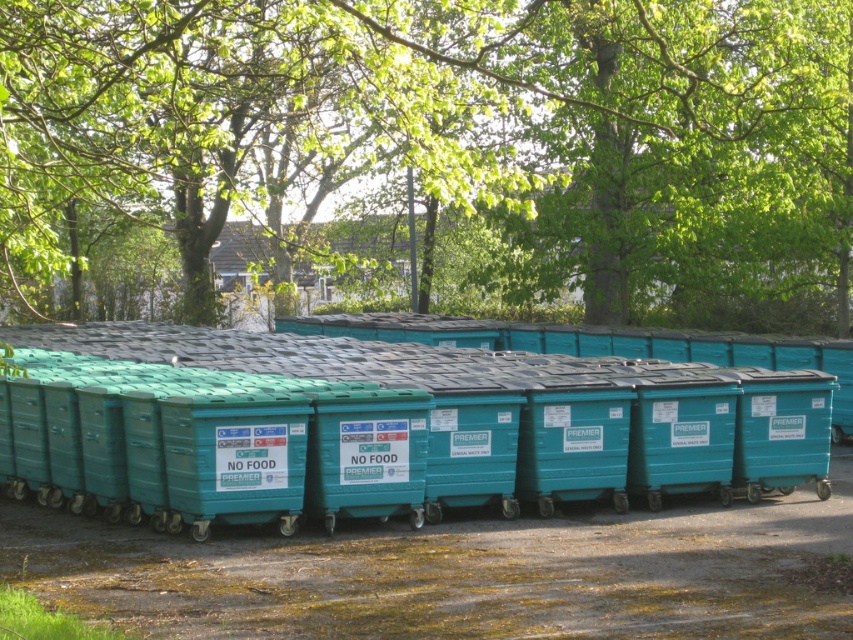
Question: Is green leafy tree at upper center to the right of teal plastic bin at center from the viewer's perspective?

Choices:
 (A) no
 (B) yes

Answer: (B)

Question: Is green leafy tree at upper center to the left of teal plastic bin at center from the viewer's perspective?

Choices:
 (A) yes
 (B) no

Answer: (B)

Question: Which object appears farthest from the camera in this image?

Choices:
 (A) green leafy tree at upper center
 (B) teal plastic bin at center

Answer: (B)

Question: Does green leafy tree at upper center appear over teal plastic bin at center?

Choices:
 (A) yes
 (B) no

Answer: (A)

Question: Which point appears closest to the camera in this image?

Choices:
 (A) (560, 385)
 (B) (480, 44)

Answer: (A)